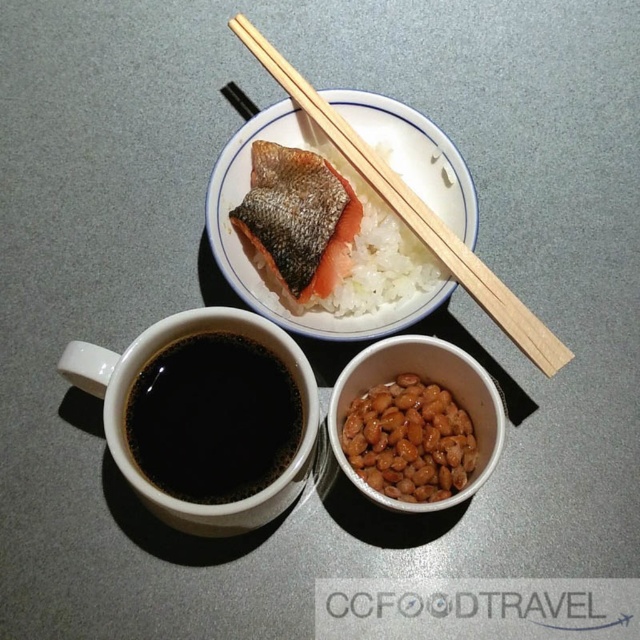
You are a food critic evaluating the presentation of this meal. Based on the height of the white polished rice at center and the wooden chopsticks at upper center, which item appears taller?

The wooden chopsticks at upper center are taller than the white polished rice at center.

You are trying to pick up the wooden chopsticks at upper center to eat the white polished rice at center. Can you reach them without moving the rice?

The wooden chopsticks at upper center is behind white polished rice at center, so you cannot reach them without moving the rice first.